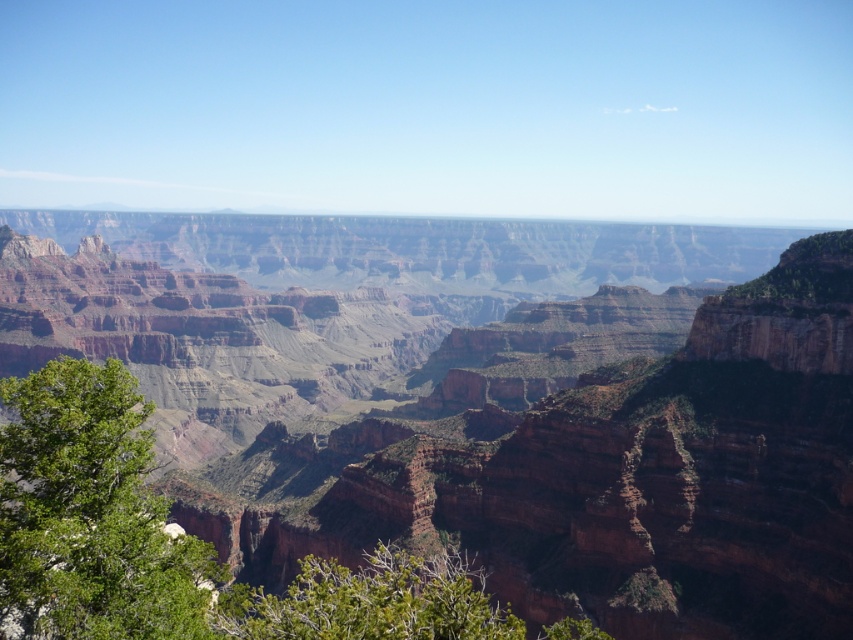
Question: Where is rustic rock canyon at center located in relation to green leafy tree at lower center in the image?

Choices:
 (A) above
 (B) below

Answer: (A)

Question: Is green leafy tree at lower left positioned behind green leafy tree at lower center?

Choices:
 (A) yes
 (B) no

Answer: (A)

Question: Which object is the closest to the green leafy tree at lower center?

Choices:
 (A) green leafy tree at lower left
 (B) rustic rock canyon at center

Answer: (A)

Question: Which point is farther to the camera?

Choices:
 (A) green leafy tree at lower left
 (B) rustic rock canyon at center

Answer: (B)

Question: Which object is farther from the camera taking this photo?

Choices:
 (A) green leafy tree at lower center
 (B) green leafy tree at lower left

Answer: (B)

Question: Can you confirm if rustic rock canyon at center is bigger than green leafy tree at lower left?

Choices:
 (A) yes
 (B) no

Answer: (A)